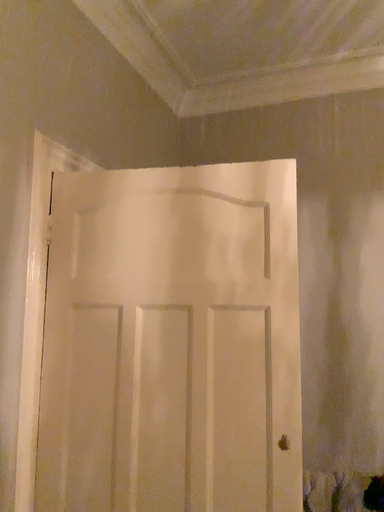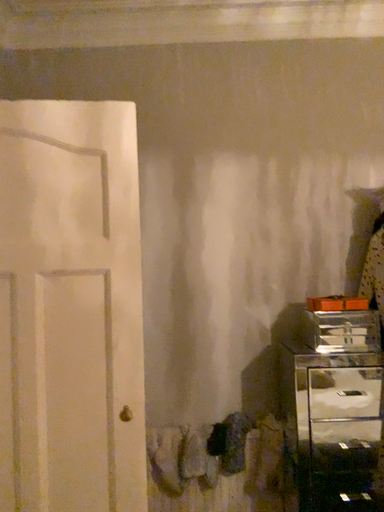
Question: Which way did the camera rotate in the video?

Choices:
 (A) rotated right
 (B) rotated left

Answer: (A)